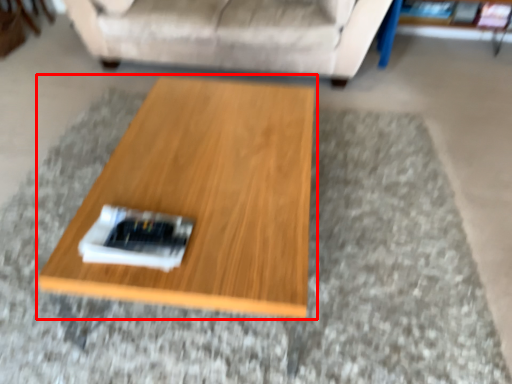
Question: From the image's perspective, what is the correct spatial relationship of coffee table (annotated by the red box) in relation to studio couch?

Choices:
 (A) below
 (B) above

Answer: (A)